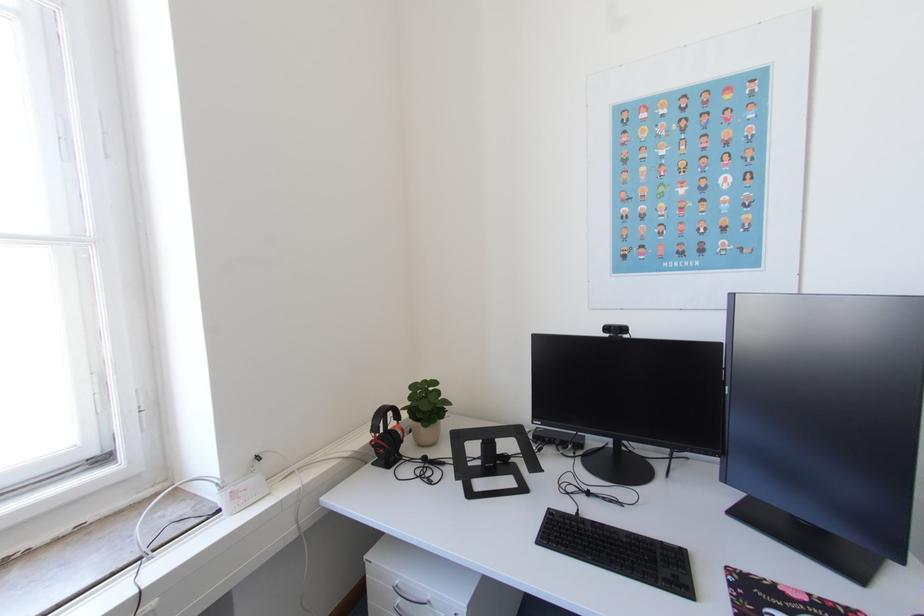
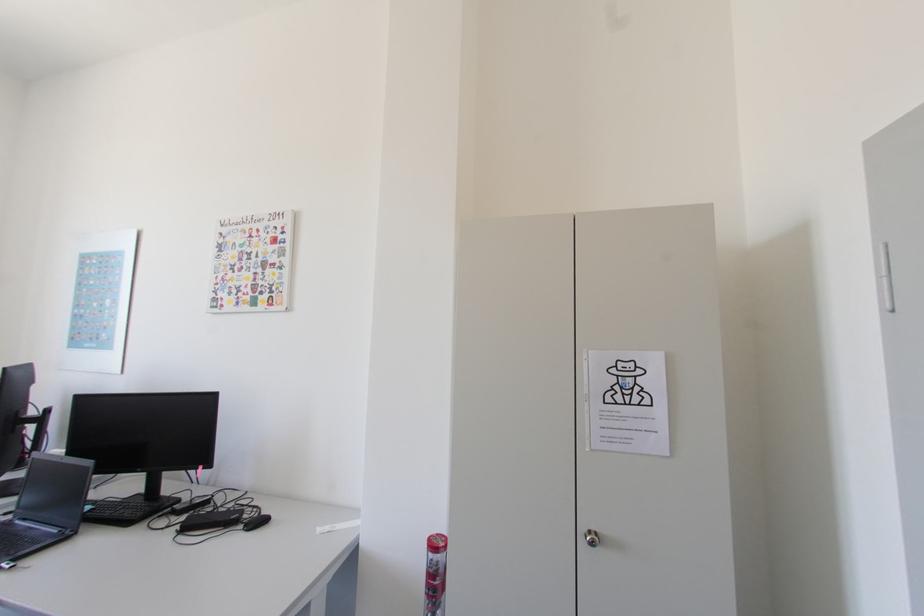
What movement of the cameraman would produce the second image?

The cameraman moved toward right, backward.